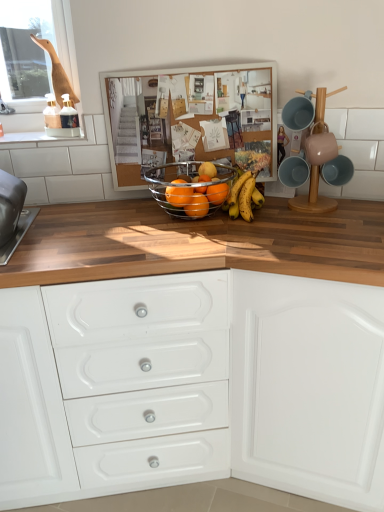
Where is `metallic orange fruit at center, the 3th orange from the right`? The image size is (384, 512). metallic orange fruit at center, the 3th orange from the right is located at coordinates (197, 206).

How much space does metallic orange fruit at center, placed as the 2th orange when sorted from left to right, occupy horizontally?

The width of metallic orange fruit at center, placed as the 2th orange when sorted from left to right, is 3.47 inches.

Image resolution: width=384 pixels, height=512 pixels. Describe the element at coordinates (312, 197) in the screenshot. I see `matte blue cup at upper right` at that location.

Measure the distance between white matte cabinet at center and camera.

A distance of 3.40 feet exists between white matte cabinet at center and camera.

What do you see at coordinates (217, 193) in the screenshot? The image size is (384, 512). I see `glossy orange at center, which is the first orange from right to left` at bounding box center [217, 193].

In order to face white glossy chest of drawers at center, should I rotate leftwards or rightwards?

Turn left approximately 10.417 degrees to face it.

This screenshot has width=384, height=512. I want to click on metallic orange fruit at center, placed as the 2th orange when sorted from left to right, so click(x=197, y=206).

Where is `glass bowl on the left of glossy orange at center, which is the first orange from right to left`? The width and height of the screenshot is (384, 512). glass bowl on the left of glossy orange at center, which is the first orange from right to left is located at coordinates (188, 188).

From the image's perspective, which is below, glossy orange at center, which is the first orange from right to left, or metallic wire basket at center?

glossy orange at center, which is the first orange from right to left, is shown below in the image.

From their relative heights in the image, would you say glossy orange at center, which is the fourth orange in left-to-right order, is taller or shorter than metallic wire basket at center?

Considering their sizes, glossy orange at center, which is the fourth orange in left-to-right order, has less height than metallic wire basket at center.

Is glossy orange at center, which is the fourth orange in left-to-right order, facing away from metallic wire basket at center?

Absolutely, glossy orange at center, which is the fourth orange in left-to-right order, is directed away from metallic wire basket at center.

Which is further, (309, 441) or (40, 297)?

The point (309, 441) is behind.

Is white matte cabinet at center wider than white glossy chest of drawers at center?

Incorrect, the width of white matte cabinet at center does not surpass that of white glossy chest of drawers at center.

Are white matte cabinet at center and white glossy chest of drawers at center making contact?

No, white matte cabinet at center is not next to white glossy chest of drawers at center.

What's the angular difference between white matte cabinet at center and white glossy chest of drawers at center's facing directions?

The angular difference between white matte cabinet at center and white glossy chest of drawers at center is 27.5 degrees.

From a real-world perspective, is yellow matte bananas at center on glossy orange at center, the 2th orange in the right-to-left sequence?

No, from a real-world perspective, yellow matte bananas at center is not on top of glossy orange at center, the 2th orange in the right-to-left sequence.

Based on the photo, between yellow matte bananas at center and glossy orange at center, acting as the third orange starting from the left, which one has larger width?

Wider between the two is yellow matte bananas at center.

Which of these two, yellow matte bananas at center or glossy orange at center, the 2th orange in the right-to-left sequence, is smaller?

With smaller size is glossy orange at center, the 2th orange in the right-to-left sequence.

From the image's perspective, would you say yellow matte bananas at center is positioned over glossy orange at center, acting as the third orange starting from the left?

No, from the image's perspective, yellow matte bananas at center is not on top of glossy orange at center, acting as the third orange starting from the left.

Can you tell me how much glossy metallic fruit basket at center, marked as the 1th orange in a left-to-right arrangement, and white matte cabinet at center differ in facing direction?

The facing directions of glossy metallic fruit basket at center, marked as the 1th orange in a left-to-right arrangement, and white matte cabinet at center are 29.1 degrees apart.

Which is in front, glossy metallic fruit basket at center, marked as the 1th orange in a left-to-right arrangement, or white matte cabinet at center?

white matte cabinet at center is closer to the camera.

From the image's perspective, between glossy metallic fruit basket at center, marked as the 1th orange in a left-to-right arrangement, and white matte cabinet at center, who is located below?

white matte cabinet at center, from the image's perspective.

Identify the location of the 2nd orange above the white matte cabinet at center (from the image's perspective). The height and width of the screenshot is (512, 384). (178, 195).

Is white glossy chest of drawers at center situated inside orange matte at center or outside?

white glossy chest of drawers at center is not inside orange matte at center, it's outside.

Is white glossy chest of drawers at center facing towards orange matte at center?

No, white glossy chest of drawers at center does not turn towards orange matte at center.

Does white glossy chest of drawers at center have a smaller size compared to orange matte at center?

Actually, white glossy chest of drawers at center might be larger than orange matte at center.

Is the position of white glossy chest of drawers at center less distant than that of orange matte at center?

Yes, it is in front of orange matte at center.

Does white matte cabinet at center have a lesser height compared to glossy metallic fruit basket at center, marked as the 1th orange in a left-to-right arrangement?

No.

Considering the relative positions of white matte cabinet at center and glossy metallic fruit basket at center, acting as the fourth orange starting from the right, in the image provided, is white matte cabinet at center to the right of glossy metallic fruit basket at center, acting as the fourth orange starting from the right, from the viewer's perspective?

Correct, you'll find white matte cabinet at center to the right of glossy metallic fruit basket at center, acting as the fourth orange starting from the right.

Locate an element on the screen. orange that is the 1st one when counting backward from the white matte cabinet at center is located at coordinates (178, 195).

Is glossy metallic fruit basket at center, acting as the fourth orange starting from the right, located within white matte cabinet at center?

No, glossy metallic fruit basket at center, acting as the fourth orange starting from the right, is not a part of white matte cabinet at center.

Locate an element on the screen. The width and height of the screenshot is (384, 512). the 2nd orange behind the yellow matte bananas at center is located at coordinates coord(217,193).

From a real-world perspective, is glossy orange at center, which is the fourth orange in left-to-right order, positioned over yellow matte bananas at center based on gravity?

Yes.

How different are the orientations of glossy orange at center, which is the fourth orange in left-to-right order, and yellow matte bananas at center in degrees?

glossy orange at center, which is the fourth orange in left-to-right order, and yellow matte bananas at center are facing 4.12 degrees away from each other.

Based on the photo, between glossy orange at center, which is the first orange from right to left, and yellow matte bananas at center, which one has smaller width?

glossy orange at center, which is the first orange from right to left, is thinner.

Locate an element on the screen. Image resolution: width=384 pixels, height=512 pixels. glass bowl on the left of glossy orange at center, which is the first orange from right to left is located at coordinates (188, 188).

Where is `cabinetry above the white glossy chest of drawers at center (from a real-world perspective)`? cabinetry above the white glossy chest of drawers at center (from a real-world perspective) is located at coordinates (308, 387).

Looking at the image, which one is located closer to white matte cabinet at center, yellow matte bananas at center or orange matte at center?

Among the two, yellow matte bananas at center is located nearer to white matte cabinet at center.

Which object lies nearer to the anchor point white matte cabinet at center, yellow matte bananas at center or glossy metallic fruit basket at center, marked as the 1th orange in a left-to-right arrangement?

The object closer to white matte cabinet at center is yellow matte bananas at center.

When comparing their distances from white matte cabinet at center, does metallic wire basket at center or glossy orange at center, the 2th orange in the right-to-left sequence, seem further?

Among the two, glossy orange at center, the 2th orange in the right-to-left sequence, is located further to white matte cabinet at center.

Based on their spatial positions, is glossy metallic fruit basket at center, marked as the 1th orange in a left-to-right arrangement, or matte blue cup at upper right closer to white matte cabinet at center?

matte blue cup at upper right is closer to white matte cabinet at center.

From the image, which object appears to be farther from glossy orange at center, which is the first orange from right to left, metallic wire basket at center or glossy orange at center, the 2th orange in the right-to-left sequence?

The object further to glossy orange at center, which is the first orange from right to left, is metallic wire basket at center.

From the image, which object appears to be nearer to metallic wire basket at center, metallic orange fruit at center, placed as the 2th orange when sorted from left to right, or matte blue cup at upper right?

metallic orange fruit at center, placed as the 2th orange when sorted from left to right, is positioned closer to the anchor metallic wire basket at center.

Which object lies further to the anchor point glossy orange at center, which is the first orange from right to left, glossy orange at center, the 2th orange in the right-to-left sequence, or white matte cabinet at center?

white matte cabinet at center is further to glossy orange at center, which is the first orange from right to left.

From the image, which object appears to be farther from glossy metallic fruit basket at center, marked as the 1th orange in a left-to-right arrangement, orange matte at center or white matte cabinet at center?

white matte cabinet at center.

Image resolution: width=384 pixels, height=512 pixels. What are the coordinates of `glass bowl between yellow matte bananas at center and white matte cabinet at center vertically` in the screenshot? It's located at (188, 188).

Identify the location of banana between orange matte at center and white matte cabinet at center in the vertical direction. The image size is (384, 512). (245, 196).

Identify the location of glass bowl that lies between matte blue cup at upper right and white glossy chest of drawers at center from top to bottom. The image size is (384, 512). (188, 188).

Image resolution: width=384 pixels, height=512 pixels. I want to click on fruit located between glossy orange at center, acting as the third orange starting from the left, and matte blue cup at upper right in the left-right direction, so click(x=207, y=169).